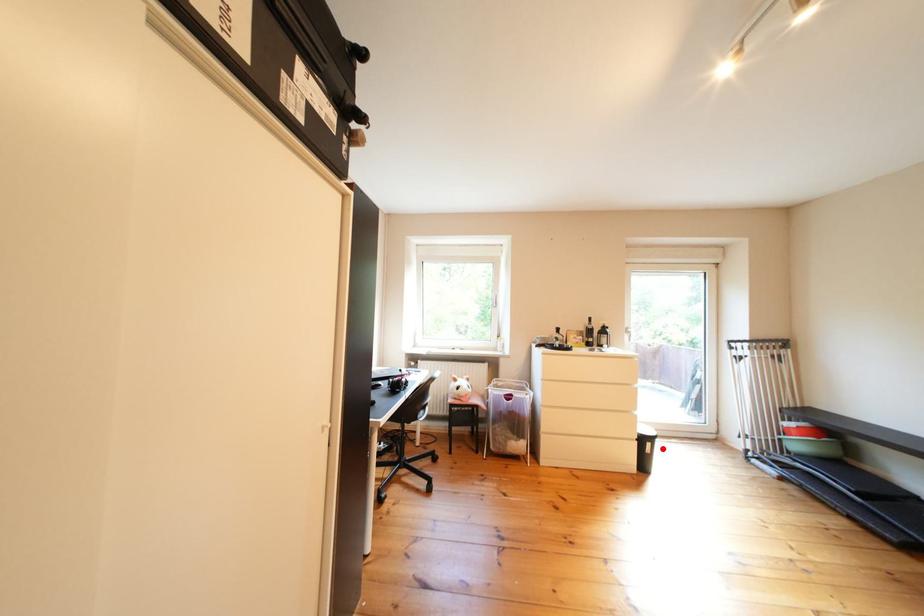
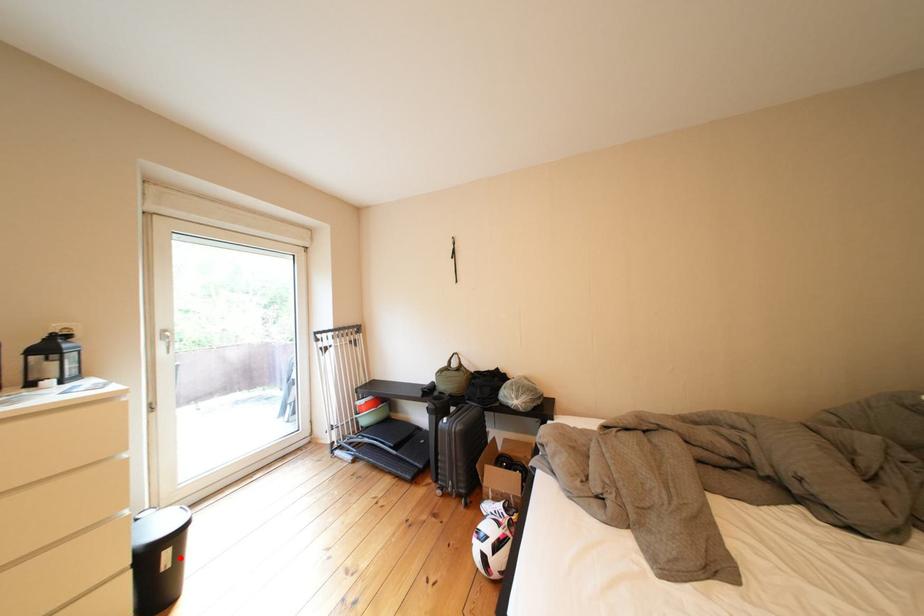
I am providing you with two images of the same scene from different viewpoints. A red point is marked on the first image and another point is marked on the second image. Is the red point in image1 aligned with the point shown in image2?

Yes